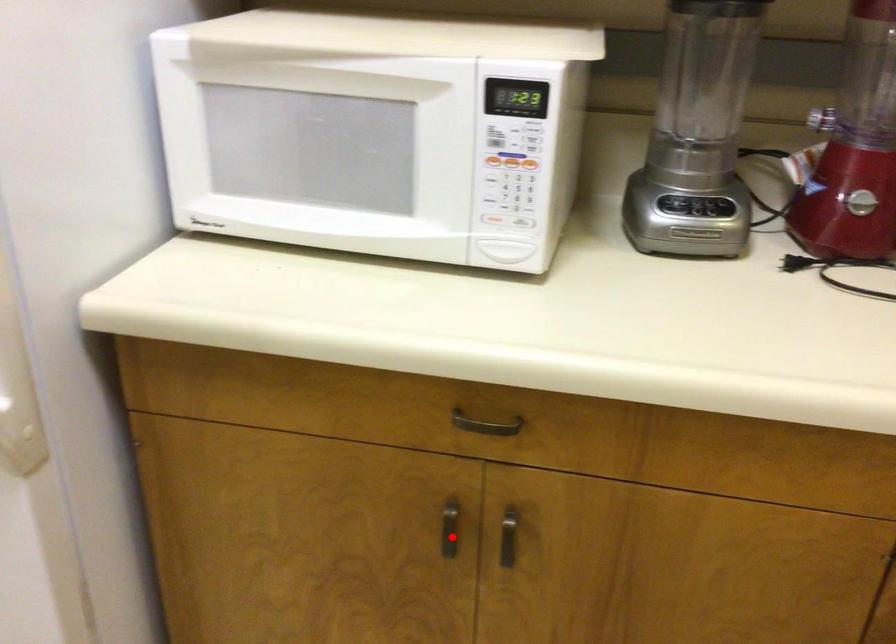
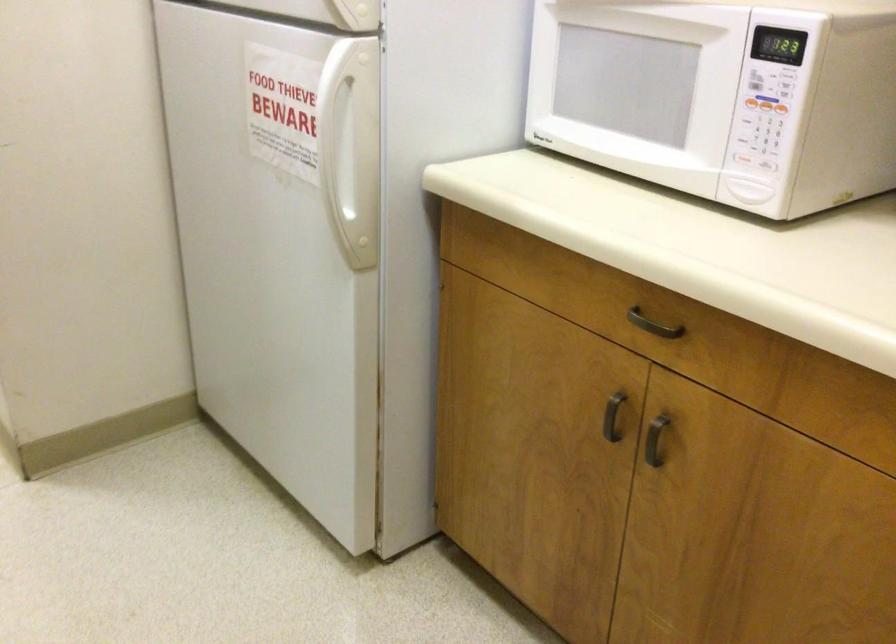
Question: I am providing you with two images of the same scene from different viewpoints. Image1 has a red point marked. In image2, the corresponding 3D location appears at what relative position? Reply with the corresponding letter.

Choices:
 (A) Closer
 (B) Farther

Answer: (B)